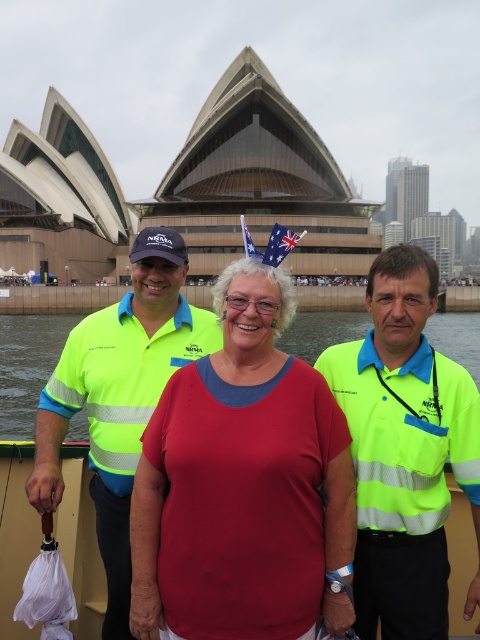
You are a photographer trying to capture a clear shot of both the neon yellow high visibility vest at center and the red fabric flag at center. Which object should you focus on first to ensure it appears larger in your photo?

The red fabric flag at center should be focused on first because it is larger than the neon yellow high visibility vest at center, ensuring it will appear bigger in the photo.